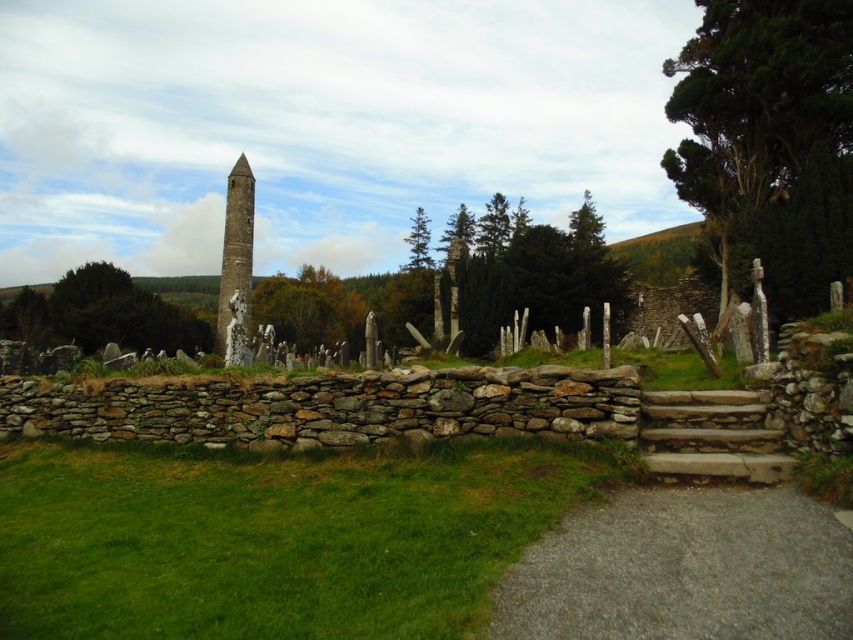
Question: Can you confirm if green grass at lower left is thinner than green leafy tree at upper right?

Choices:
 (A) yes
 (B) no

Answer: (A)

Question: Which object appears farthest from the camera in this image?

Choices:
 (A) green leafy tree at left
 (B) green textured stone at center

Answer: (A)

Question: Which of the following is the farthest from the observer?

Choices:
 (A) tap(820, 108)
 (B) tap(221, 323)
 (C) tap(590, 276)
 (D) tap(575, 474)

Answer: (B)

Question: Considering the real-world distances, which object is closest to the green leafy tree at left?

Choices:
 (A) smooth stone tower at center
 (B) green textured tree at center
 (C) green textured stone at center

Answer: (A)

Question: Does green leafy tree at upper right have a larger size compared to smooth stone tower at center?

Choices:
 (A) no
 (B) yes

Answer: (A)

Question: Does gray gravel path at lower right have a larger size compared to green textured stone at center?

Choices:
 (A) yes
 (B) no

Answer: (B)